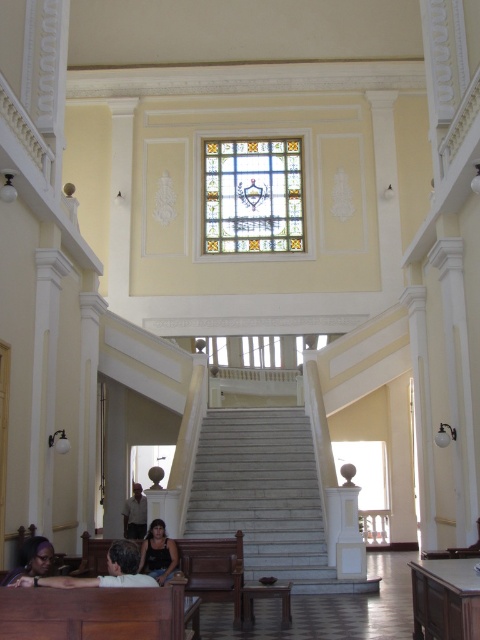
Question: Which point is farther to the camera?

Choices:
 (A) dark brown leather jacket at lower center
 (B) light brown leather jacket at lower center

Answer: (B)

Question: Can you confirm if white marble stairs at center is positioned below stained glass at center?

Choices:
 (A) yes
 (B) no

Answer: (A)

Question: Which object is the farthest from the dark brown leather jacket at lower center?

Choices:
 (A) matte black tank top at lower center
 (B) wooden polished bench at lower left
 (C) light brown leather jacket at lower center

Answer: (C)

Question: Does stained glass at center appear over matte black tank top at lower center?

Choices:
 (A) no
 (B) yes

Answer: (B)

Question: Can you confirm if wooden polished bench at lower left is smaller than matte black tank top at lower center?

Choices:
 (A) yes
 (B) no

Answer: (B)

Question: Which object is closer to the camera taking this photo?

Choices:
 (A) matte black person at lower left
 (B) white marble stairs at center
 (C) light brown leather jacket at lower center

Answer: (A)